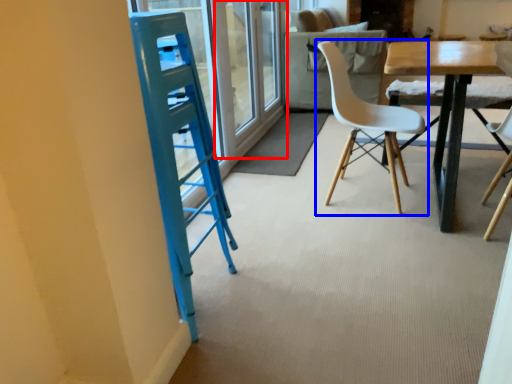
Question: Which of the following is the closest to the observer, screen door (highlighted by a red box) or chair (highlighted by a blue box)?

Choices:
 (A) screen door
 (B) chair

Answer: (B)